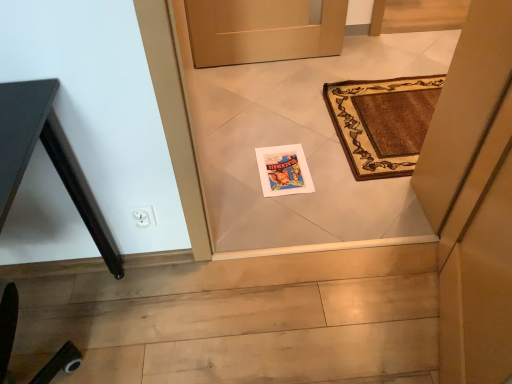
The width and height of the screenshot is (512, 384). In order to click on unoccupied region to the right of black matte table at left in this screenshot , I will do `click(215, 315)`.